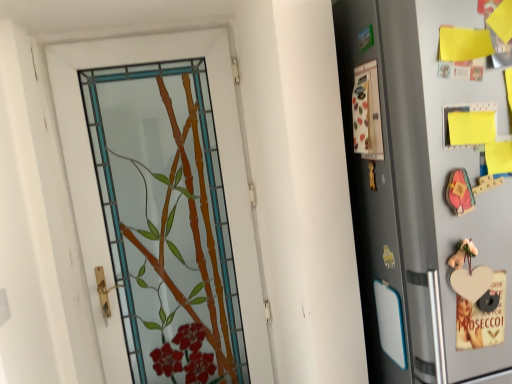
Question: Based on their sizes in the image, would you say silver metallic refrigerator at right is bigger or smaller than matte plastic screen door at right?

Choices:
 (A) small
 (B) big

Answer: (B)

Question: From the image's perspective, relative to matte plastic screen door at right, is silver metallic refrigerator at right above or below?

Choices:
 (A) below
 (B) above

Answer: (A)

Question: Considering the real-world distances, which object is closest to the matte plastic screen door at right?

Choices:
 (A) stained glass door at center
 (B) silver metallic refrigerator at right

Answer: (B)

Question: Estimate the real-world distances between objects in this image. Which object is farther from the silver metallic refrigerator at right?

Choices:
 (A) stained glass door at center
 (B) matte plastic screen door at right

Answer: (A)